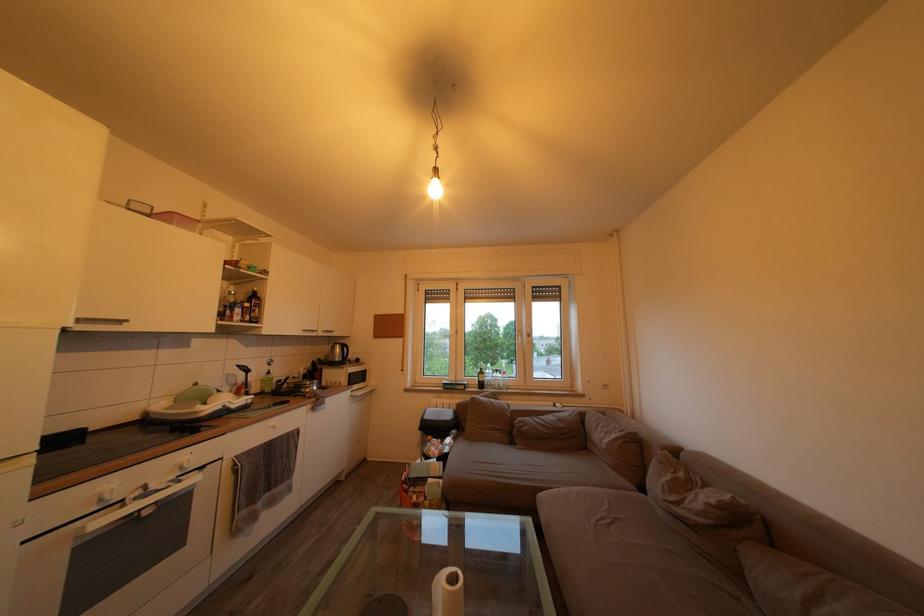
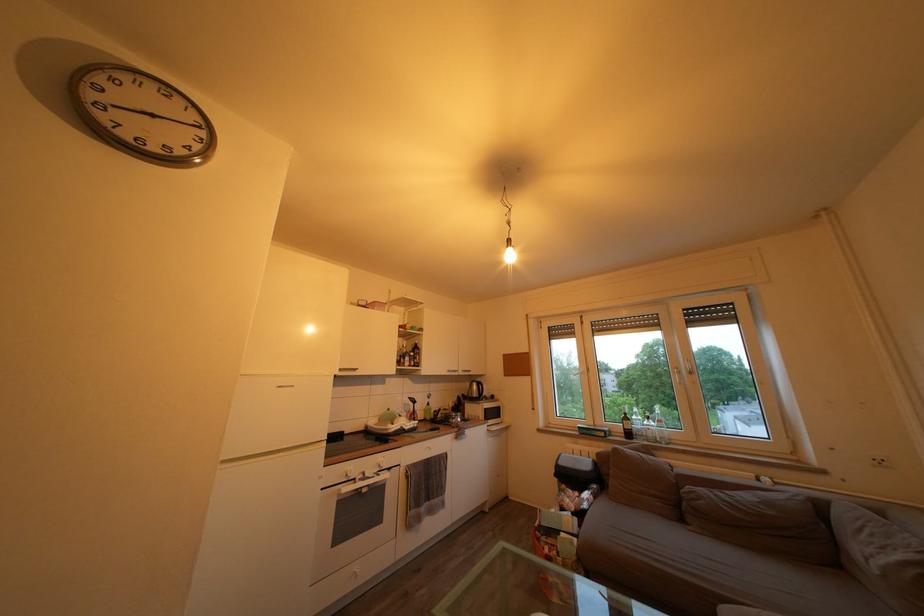
Question: The images are taken continuously from a first-person perspective. In which direction is your viewpoint rotating?

Choices:
 (A) Left
 (B) Right
 (C) Up
 (D) Down

Answer: (A)